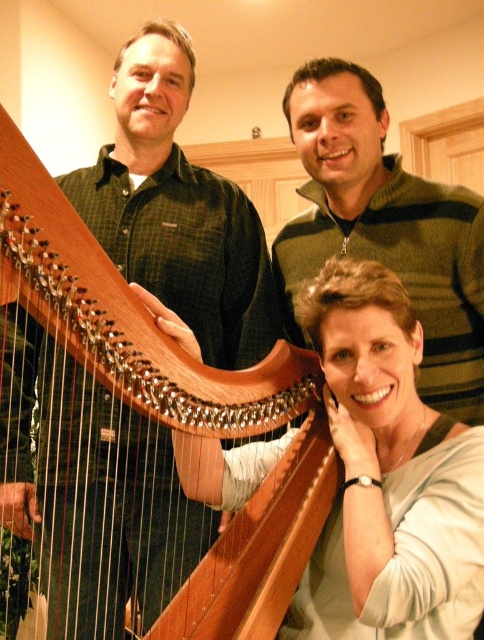
You are a photographer setting up a shoot in this room. You need to place a small microphone stand between the matte white shirt at center and the green striped sweater at upper right. Based on their positions, where should you position the microphone stand?

The microphone stand should be placed between the matte white shirt at center and the green striped sweater at upper right, as the matte white shirt at center is below the green striped sweater at upper right.

You are a photographer adjusting your camera settings in a cozy room with warm lighting. You notice the matte white shirt at center and the wooden harp at center. Which object is closer to the camera lens?

The matte white shirt at center is positioned under the wooden harp at center, meaning the harp is closer to the camera lens.

You are standing in the room and want to place a small plant pot exactly at the point labeled point (344, 596). If your current position is 1.29 meters away from that point, can you reach the point without moving your feet?

The distance between you and point (344, 596) is 1.29 meters. Since the average human arm reach is about 1 meter, you cannot reach the point without moving your feet.